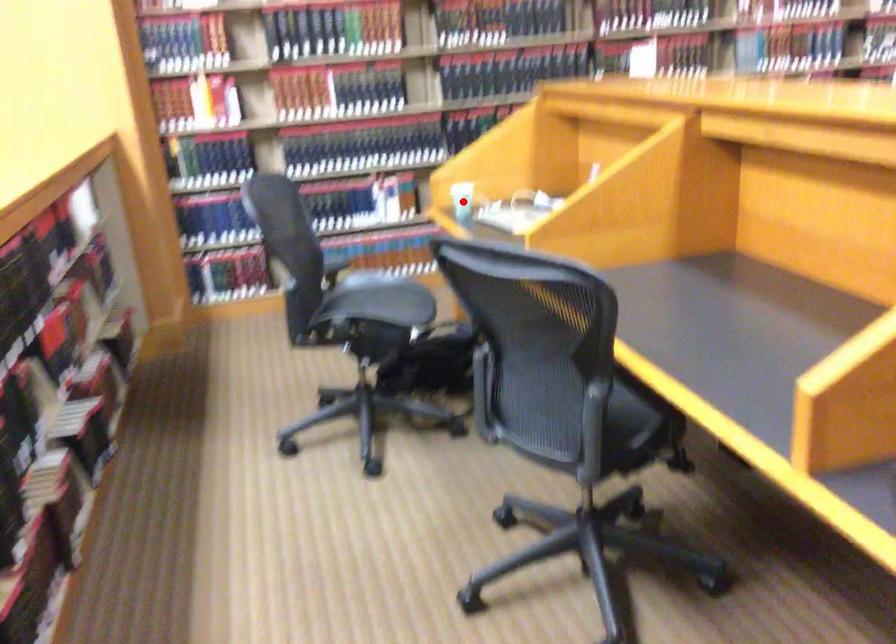
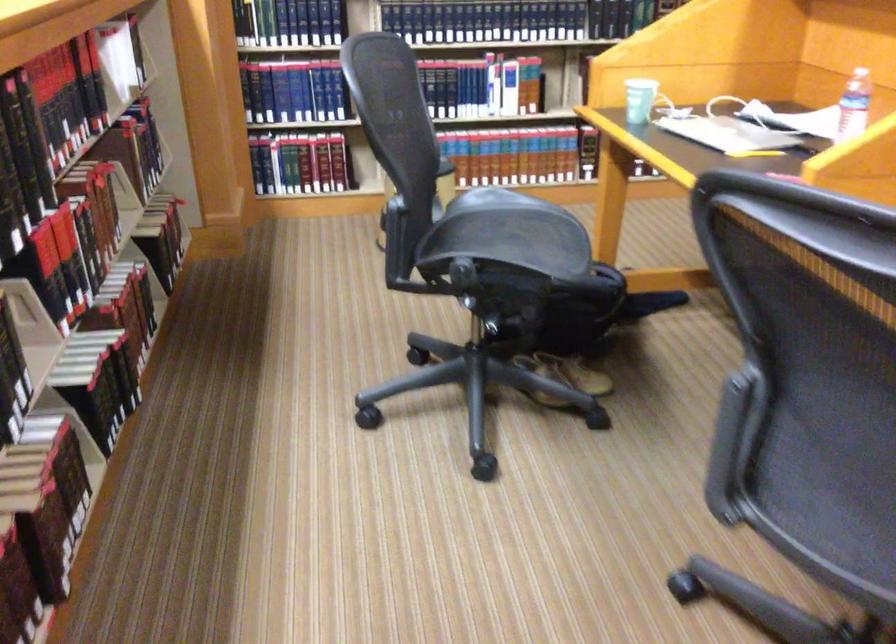
Question: I am providing you with two images of the same scene from different viewpoints. A red point is shown in image1. For the corresponding object point in image2, is it positioned nearer or farther from the camera?

Choices:
 (A) Nearer
 (B) Farther

Answer: (A)